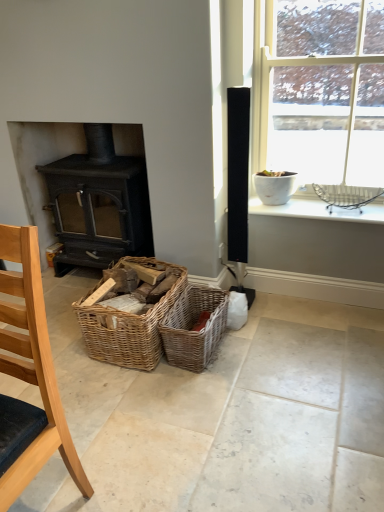
Identify the location of vacant area that lies in front of woven wood baskets at center, which ranks as the 1th picnic basket in left-to-right order. pos(132,397).